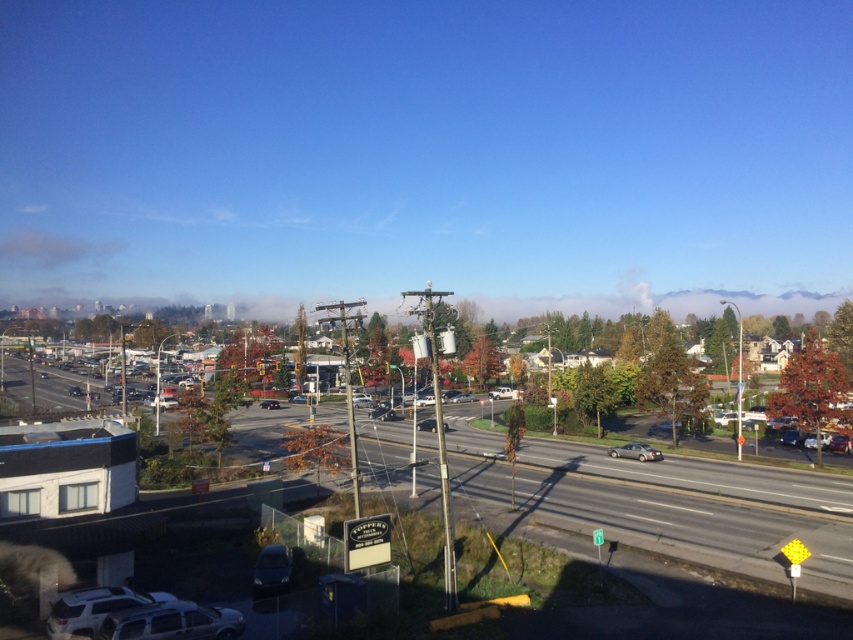
Which is in front, point (431, 420) or point (300, 400)?

Point (431, 420) is in front.

Can you confirm if metallic silver sedan at center is shorter than matte black sedan at center?

No, metallic silver sedan at center is not shorter than matte black sedan at center.

Is point (434, 429) positioned behind point (291, 397)?

No, it is not.

Where is `metallic silver sedan at center`? The image size is (853, 640). metallic silver sedan at center is located at coordinates (426, 424).

Is asphalt road at lower center smaller than matte black sedan at center?

No.

Between asphalt road at lower center and matte black sedan at center, which one has more height?

Standing taller between the two is asphalt road at lower center.

Between point (469, 404) and point (296, 396), which one is positioned in front?

Positioned in front is point (469, 404).

Image resolution: width=853 pixels, height=640 pixels. I want to click on asphalt road at lower center, so click(694, 508).

Who is lower down, metallic silver sedan at center or shiny black sedan at center?

shiny black sedan at center is below.

Does point (432, 422) lie in front of point (264, 401)?

Yes, it is.

Find the location of `metallic silver sedan at center`. metallic silver sedan at center is located at coordinates (426, 424).